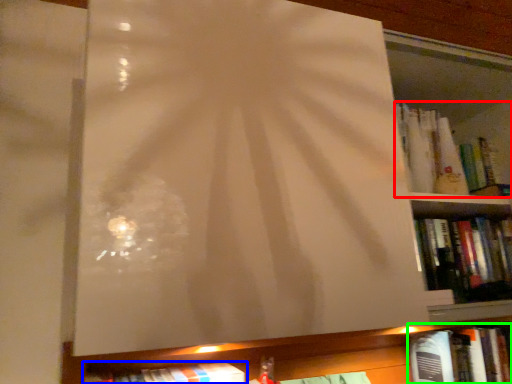
Question: Which is nearer to the book (highlighted by a red box)? book (highlighted by a blue box) or book (highlighted by a green box).

Choices:
 (A) book
 (B) book

Answer: (B)